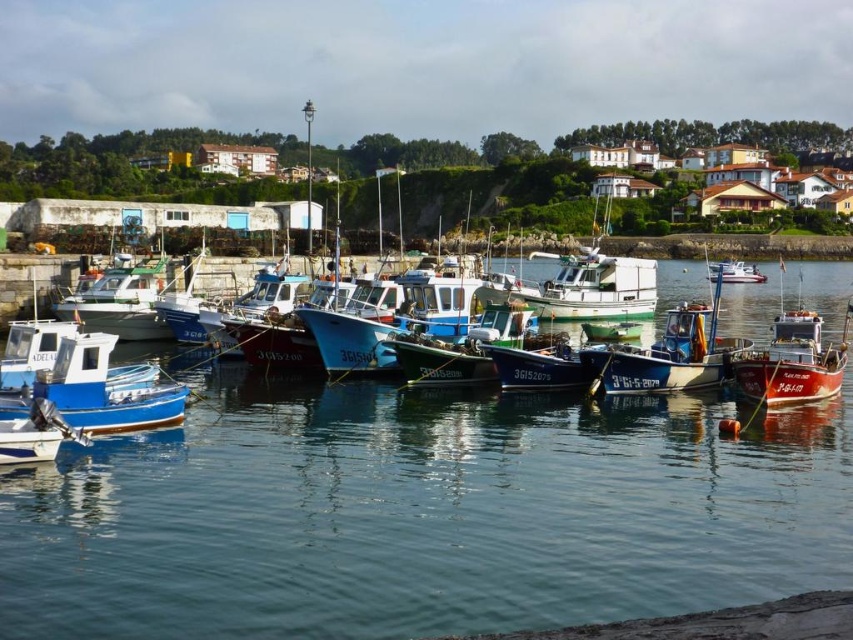
You are a maintenance worker assigned to inspect the white plastic boat at center. You notice that the clear water at center is directly beneath it. What does this indicate about the boat?

The clear water at center being positioned under the white plastic boat at center indicates that the boat is floating on the water.

You are a boat operator who needs to navigate a new boat into the harbor. You observe the clear water at center and the white plastic boat at center. Which object is wider?

The clear water at center is wider than the white plastic boat at center according to the description.

You are a photographer planning to take a picture of the white plastic boat at center and the clear water at center. Based on their positions, which object should you focus on first if you want to capture both in a single shot without moving the camera?

The clear water at center is to the left of the white plastic boat at center, so you should focus on the white plastic boat at center first as it is closer to the right side, ensuring both are within the frame when centered.